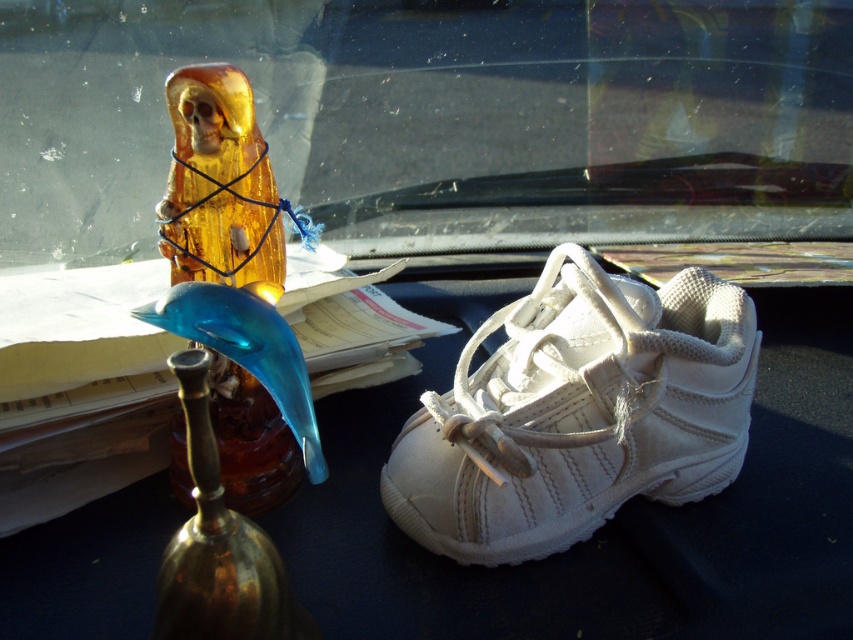
Between point (625, 17) and point (227, 451), which one is positioned behind?

Point (625, 17)

Which is below, transparent glass windshield at upper center or translucent amber statue at left?

Positioned lower is translucent amber statue at left.

Who is more forward, (x=30, y=12) or (x=209, y=161)?

Point (x=209, y=161) is more forward.

Identify the location of transparent glass windshield at upper center. (440, 118).

Which of these two, transparent glass windshield at upper center or white suede running shoe at center, stands shorter?

white suede running shoe at center

Is the position of transparent glass windshield at upper center more distant than that of white suede running shoe at center?

Yes, it is.

Is point (670, 204) positioned before point (606, 497)?

No, (670, 204) is behind (606, 497).

Where is `transparent glass windshield at upper center`? Image resolution: width=853 pixels, height=640 pixels. transparent glass windshield at upper center is located at coordinates (440, 118).

Between point (740, 304) and point (302, 225), which one is positioned in front?

Point (740, 304) is more forward.

Is white suede running shoe at center to the left of translucent amber statue at left from the viewer's perspective?

In fact, white suede running shoe at center is to the right of translucent amber statue at left.

In order to click on white suede running shoe at center in this screenshot , I will do `click(578, 413)`.